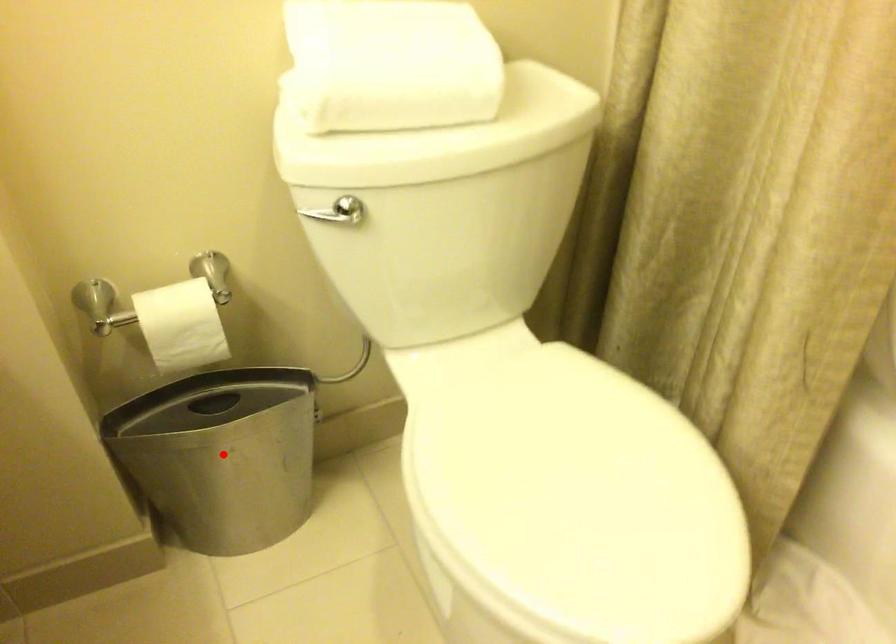
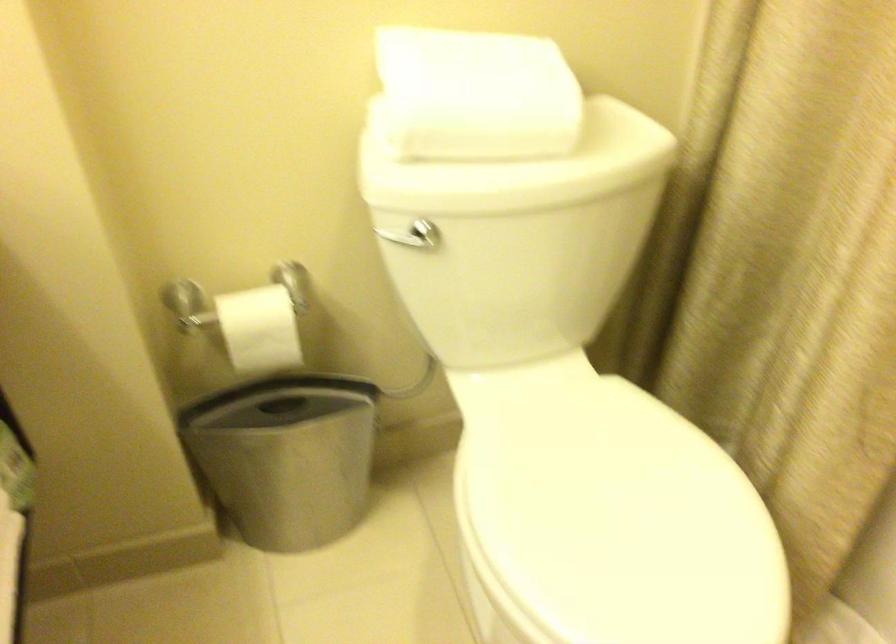
In the second image, find the point that corresponds to the highlighted location in the first image.

(286, 456)